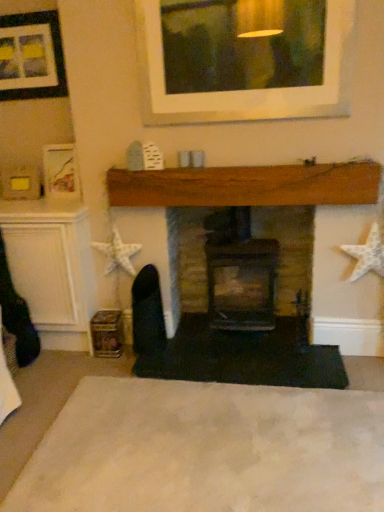
Question: Considering the relative sizes of brick fireplace at center, placed as the second fireplace when sorted from left to right, and matte black picture frame at upper left in the image provided, is brick fireplace at center, placed as the second fireplace when sorted from left to right, wider than matte black picture frame at upper left?

Choices:
 (A) no
 (B) yes

Answer: (B)

Question: Would you consider brick fireplace at center, placed as the second fireplace when sorted from left to right, to be distant from matte black picture frame at upper left?

Choices:
 (A) yes
 (B) no

Answer: (A)

Question: Is brick fireplace at center, the first fireplace from the right, directly adjacent to matte black picture frame at upper left?

Choices:
 (A) no
 (B) yes

Answer: (A)

Question: Is brick fireplace at center, the first fireplace from the right, bigger than matte black picture frame at upper left?

Choices:
 (A) yes
 (B) no

Answer: (A)

Question: From the image's perspective, would you say brick fireplace at center, placed as the second fireplace when sorted from left to right, is positioned over matte black picture frame at upper left?

Choices:
 (A) yes
 (B) no

Answer: (B)

Question: Is brick fireplace at center, the first fireplace from the right, positioned beyond the bounds of matte black picture frame at upper left?

Choices:
 (A) no
 (B) yes

Answer: (B)

Question: Does wooden fireplace at center, arranged as the second fireplace when viewed from the right, have a greater height compared to matte black picture frame at upper left?

Choices:
 (A) no
 (B) yes

Answer: (B)

Question: Is wooden fireplace at center, which is the 1th fireplace in left-to-right order, wider than matte black picture frame at upper left?

Choices:
 (A) no
 (B) yes

Answer: (B)

Question: Is wooden fireplace at center, arranged as the second fireplace when viewed from the right, oriented towards matte black picture frame at upper left?

Choices:
 (A) yes
 (B) no

Answer: (B)

Question: Is there a large distance between wooden fireplace at center, which is the 1th fireplace in left-to-right order, and matte black picture frame at upper left?

Choices:
 (A) yes
 (B) no

Answer: (A)

Question: Does wooden fireplace at center, which is the 1th fireplace in left-to-right order, have a lesser width compared to matte black picture frame at upper left?

Choices:
 (A) no
 (B) yes

Answer: (A)

Question: Can you confirm if wooden fireplace at center, arranged as the second fireplace when viewed from the right, is positioned to the left of matte black picture frame at upper left?

Choices:
 (A) yes
 (B) no

Answer: (B)

Question: Is wooden fireplace at center, arranged as the second fireplace when viewed from the right, located outside brick fireplace at center, the first fireplace from the right?

Choices:
 (A) no
 (B) yes

Answer: (B)